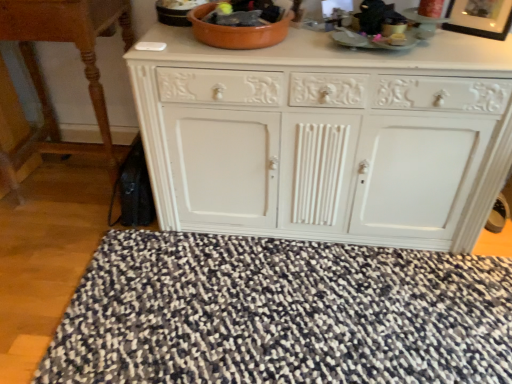
Where is `vacant space underneath wooden table at left (from a real-world perspective)`? This screenshot has width=512, height=384. vacant space underneath wooden table at left (from a real-world perspective) is located at coordinates (82, 185).